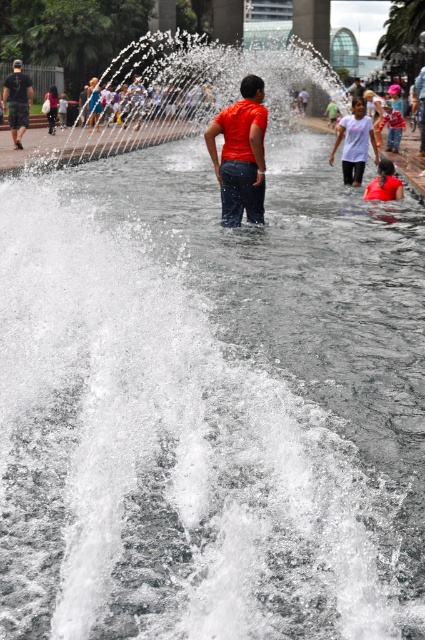
Question: Does white matte shirt at upper center have a smaller size compared to red shirt at center?

Choices:
 (A) no
 (B) yes

Answer: (B)

Question: Does white matte shirt at upper center have a lesser width compared to dark gray t-shirt at center?

Choices:
 (A) no
 (B) yes

Answer: (B)

Question: Is matte orange shirt at center positioned at the back of white matte shirt at upper center?

Choices:
 (A) yes
 (B) no

Answer: (B)

Question: Among these points, which one is nearest to the camera?

Choices:
 (A) (388, 106)
 (B) (234, 193)

Answer: (B)

Question: Estimate the real-world distances between objects in this image. Which object is closer to the white matte shirt at upper center?

Choices:
 (A) dark gray t-shirt at center
 (B) matte orange shirt at center

Answer: (B)

Question: Which point is farther to the camera?

Choices:
 (A) (334, 154)
 (B) (388, 140)
 (C) (261, 100)

Answer: (B)